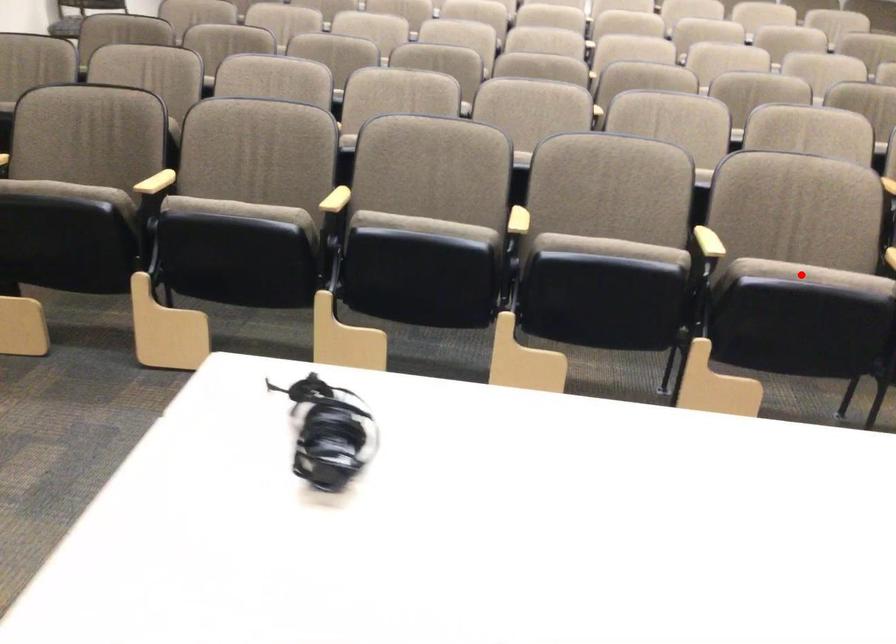
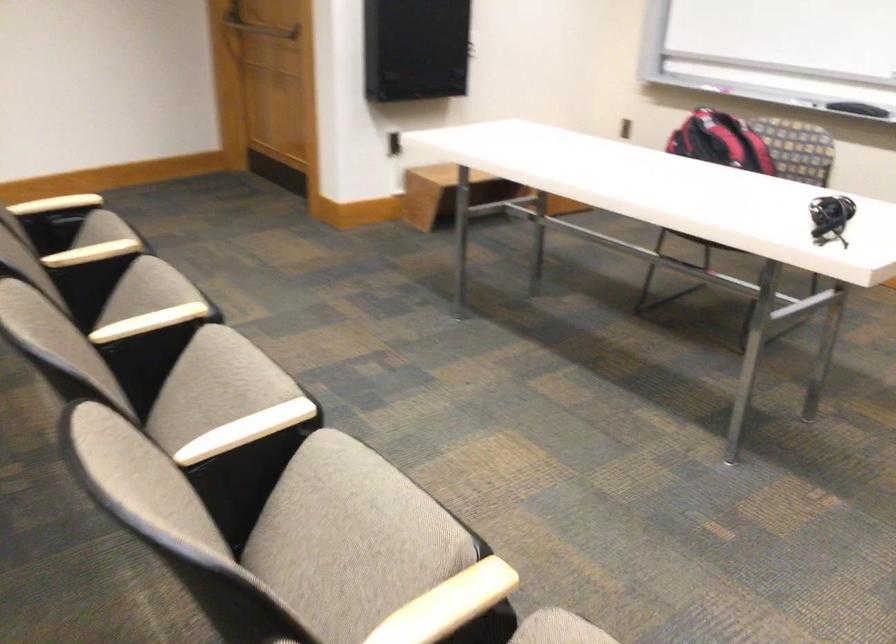
Find the pixel in the second image that matches the highlighted location in the first image.

(147, 290)